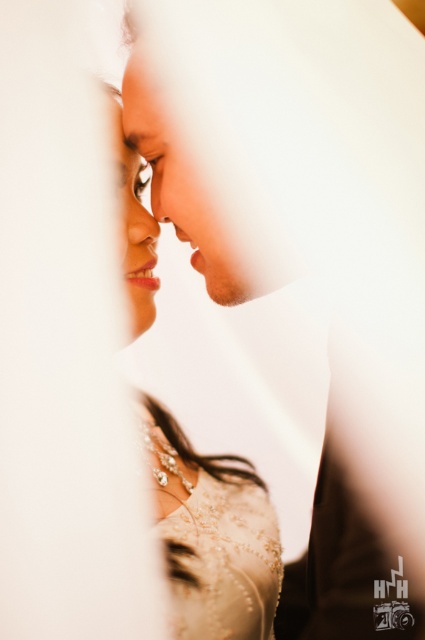
You are a photographer trying to capture the perfect shot of the wedding scene. You notice two points of interest in the image. The first point is at coordinates point (x=144, y=291), and the second is at point (x=180, y=612). Which of these points is closer to the camera?

Point (x=180, y=612) is closer to the camera because the description states that point (x=144, y=291) is behind point (x=180, y=612).

You are a photographer at a wedding. You need to position a light source between the ivory satin dress at center and the smooth skin man at center. Is there enough space to place a 12 inch wide light stand between them?

The distance between the ivory satin dress at center and the smooth skin man at center is 12.94 inches. Since the light stand is 12 inches wide, there is enough space to place it between them as 12.94 inches is slightly larger than 12 inches.

You are a photographer at a wedding who wants to ensure both the smooth skin man at center and the ivory beaded dress at center are clearly visible in the photo. Given their sizes, which one should you focus on to ensure both are in focus?

Since the smooth skin man at center is larger in size than the ivory beaded dress at center, you should focus on the smooth skin man at center to ensure both are in focus, as focusing on the larger object increases the chances of the smaller one also being in focus.